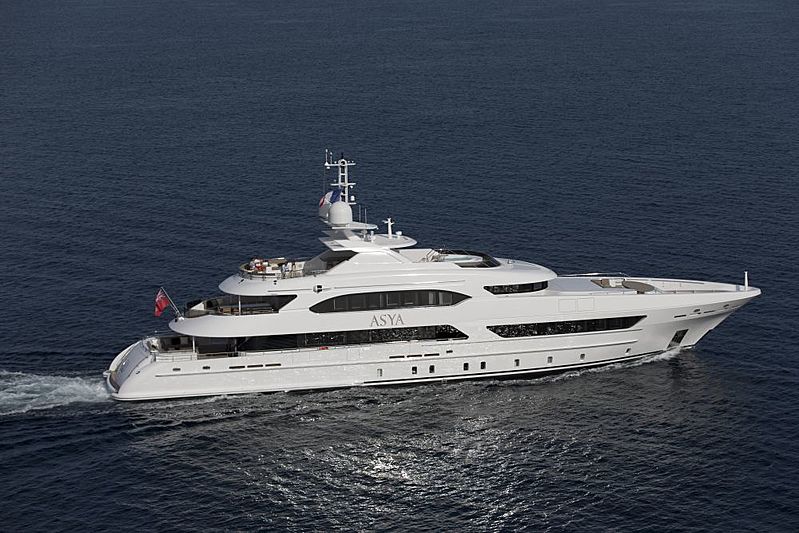
The height and width of the screenshot is (533, 799). In order to click on bottom windows in this screenshot , I will do `click(415, 368)`, `click(432, 365)`, `click(463, 365)`, `click(478, 366)`, `click(511, 359)`, `click(551, 360)`, `click(578, 356)`, `click(627, 347)`.